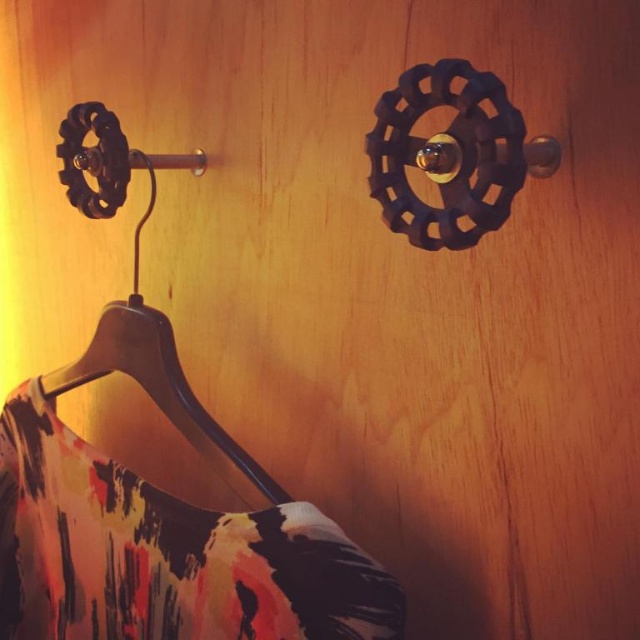
You are organizing a clothing store and need to hang a printed fabric dress at lower left on a wooden hanger at lower left. Based on the scene description, where should you place the dress relative to the hanger?

The printed fabric dress at lower left should be placed below the wooden hanger at lower left as it is already positioned there according to the scene description.